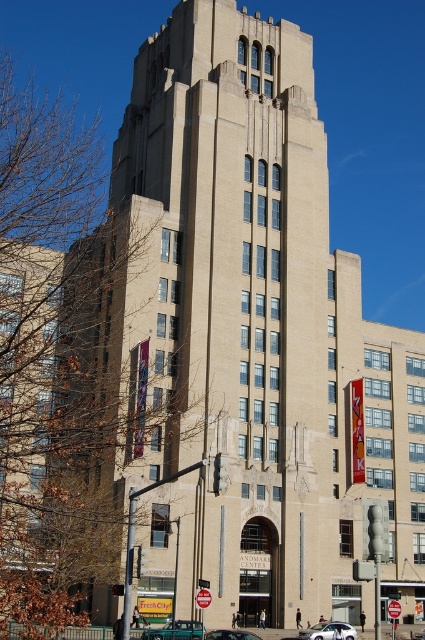
Can you confirm if metallic teal van at center is wider than metallic teal sedan at center?

Indeed, metallic teal van at center has a greater width compared to metallic teal sedan at center.

Who is taller, metallic teal van at center or metallic teal sedan at center?

Standing taller between the two is metallic teal sedan at center.

Is point (147, 632) farther from camera compared to point (214, 634)?

No, (147, 632) is closer to viewer.

The height and width of the screenshot is (640, 425). Find the location of `metallic teal van at center`. metallic teal van at center is located at coordinates pos(175,630).

Does silver metallic sedan at center have a larger size compared to metallic teal sedan at center?

Actually, silver metallic sedan at center might be smaller than metallic teal sedan at center.

Which is more to the left, silver metallic sedan at center or metallic teal sedan at center?

metallic teal sedan at center is more to the left.

Who is more distant from viewer, (325, 625) or (226, 636)?

Positioned behind is point (325, 625).

This screenshot has height=640, width=425. Identify the location of silver metallic sedan at center. (328, 632).

What do you see at coordinates (175, 630) in the screenshot? I see `metallic teal van at center` at bounding box center [175, 630].

Which of these two, metallic teal van at center or silver metallic sedan at center, stands taller?

With more height is silver metallic sedan at center.

The width and height of the screenshot is (425, 640). What do you see at coordinates (175, 630) in the screenshot?
I see `metallic teal van at center` at bounding box center [175, 630].

At what (x,y) coordinates should I click in order to perform the action: click on metallic teal van at center. Please return your answer as a coordinate pair (x, y). The width and height of the screenshot is (425, 640). Looking at the image, I should click on (175, 630).